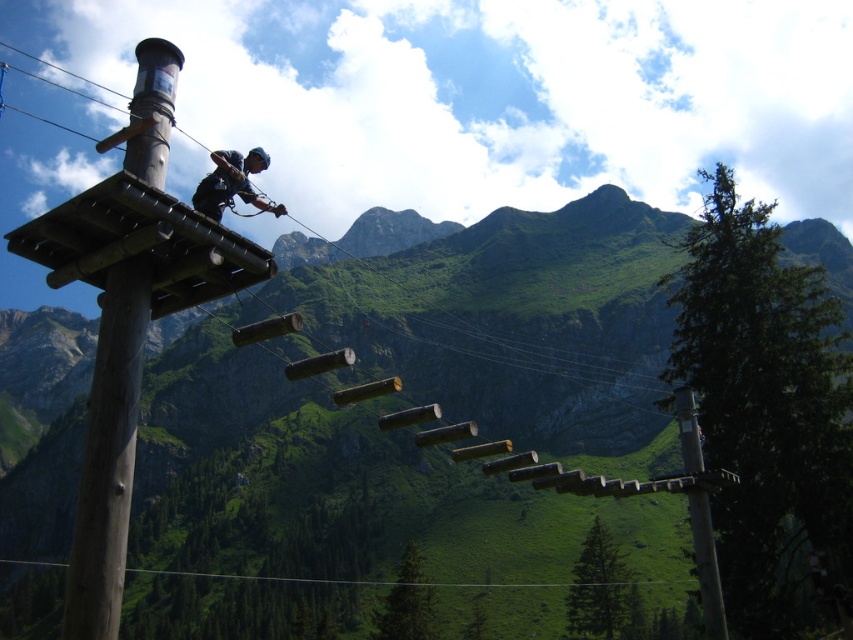
You are standing at the starting point of the obstacle course and see two points marked on the suspended platforms. The first point is at coordinates point (80, 545) and the second is at point (213, 179). Which point is closer to you?

Point (80, 545) is closer to the viewer than point (213, 179).

You are a safety inspector checking the equipment in the obstacle course. The brown wooden pole at upper left is part of the support structure for the dark blue fabric harness at center. Based on their sizes, which one do you think is more likely to be the main support beam?

The dark blue fabric harness at center is larger than the brown wooden pole at upper left, so the brown wooden pole at upper left is more likely to be the main support beam since it has a smaller size and is positioned at the upper left for structural stability.